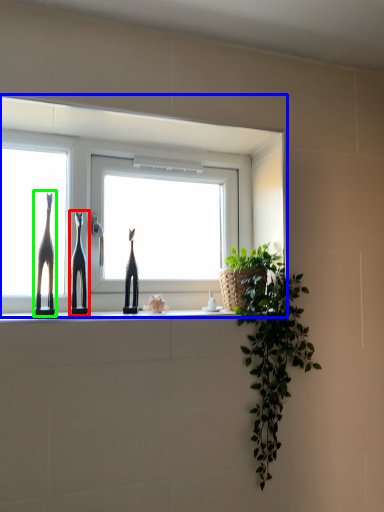
Question: Based on their relative distances, which object is nearer to sculpture (highlighted by a red box)? Choose from window (highlighted by a blue box) and giraffe (highlighted by a green box).

Choices:
 (A) window
 (B) giraffe

Answer: (B)